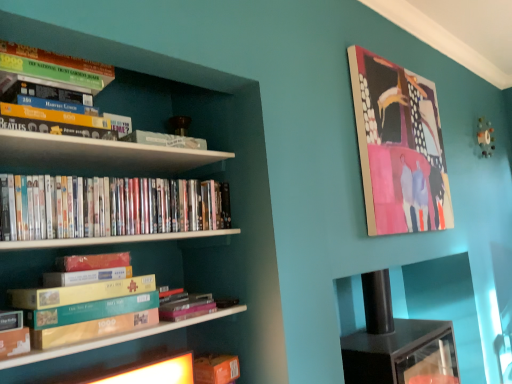
Question: Should I look upward or downward to see teal cardboard box at lower left, which ranks as the 3th book in top-to-bottom order?

Choices:
 (A) up
 (B) down

Answer: (B)

Question: Could you tell me if black glossy cabinet at lower right is turned towards teal cardboard box at lower left, which is the third book from bottom to top?

Choices:
 (A) no
 (B) yes

Answer: (A)

Question: Is black glossy cabinet at lower right looking in the opposite direction of teal cardboard box at lower left, which ranks as the 3th book in top-to-bottom order?

Choices:
 (A) no
 (B) yes

Answer: (A)

Question: Does black glossy cabinet at lower right have a larger size compared to teal cardboard box at lower left, which is the third book from bottom to top?

Choices:
 (A) no
 (B) yes

Answer: (B)

Question: Is black glossy cabinet at lower right completely or partially outside of teal cardboard box at lower left, which is the third book from bottom to top?

Choices:
 (A) no
 (B) yes

Answer: (B)

Question: Considering the relative sizes of black glossy cabinet at lower right and teal cardboard box at lower left, which ranks as the 3th book in top-to-bottom order, in the image provided, is black glossy cabinet at lower right shorter than teal cardboard box at lower left, which ranks as the 3th book in top-to-bottom order,?

Choices:
 (A) no
 (B) yes

Answer: (A)

Question: From the image's perspective, is black glossy cabinet at lower right located beneath teal cardboard box at lower left, which ranks as the 3th book in top-to-bottom order?

Choices:
 (A) no
 (B) yes

Answer: (B)

Question: Is matte wooden picture frame at upper right positioned with its back to hardcover book at center, placed as the 4th book when sorted from top to bottom?

Choices:
 (A) yes
 (B) no

Answer: (B)

Question: Considering the relative sizes of matte wooden picture frame at upper right and hardcover book at center, arranged as the second book when ordered from the bottom, in the image provided, is matte wooden picture frame at upper right shorter than hardcover book at center, arranged as the second book when ordered from the bottom,?

Choices:
 (A) yes
 (B) no

Answer: (B)

Question: Is matte wooden picture frame at upper right further to the viewer compared to hardcover book at center, placed as the 4th book when sorted from top to bottom?

Choices:
 (A) yes
 (B) no

Answer: (A)

Question: Does matte wooden picture frame at upper right have a lesser width compared to hardcover book at center, placed as the 4th book when sorted from top to bottom?

Choices:
 (A) no
 (B) yes

Answer: (B)

Question: From the image's perspective, would you say matte wooden picture frame at upper right is positioned over hardcover book at center, placed as the 4th book when sorted from top to bottom?

Choices:
 (A) no
 (B) yes

Answer: (B)

Question: Is matte wooden picture frame at upper right oriented towards hardcover book at center, arranged as the second book when ordered from the bottom?

Choices:
 (A) yes
 (B) no

Answer: (B)

Question: Is green cardboard book at upper left, which is counted as the fifth book, starting from the bottom, completely or partially outside of white glossy bookshelf at left?

Choices:
 (A) yes
 (B) no

Answer: (B)